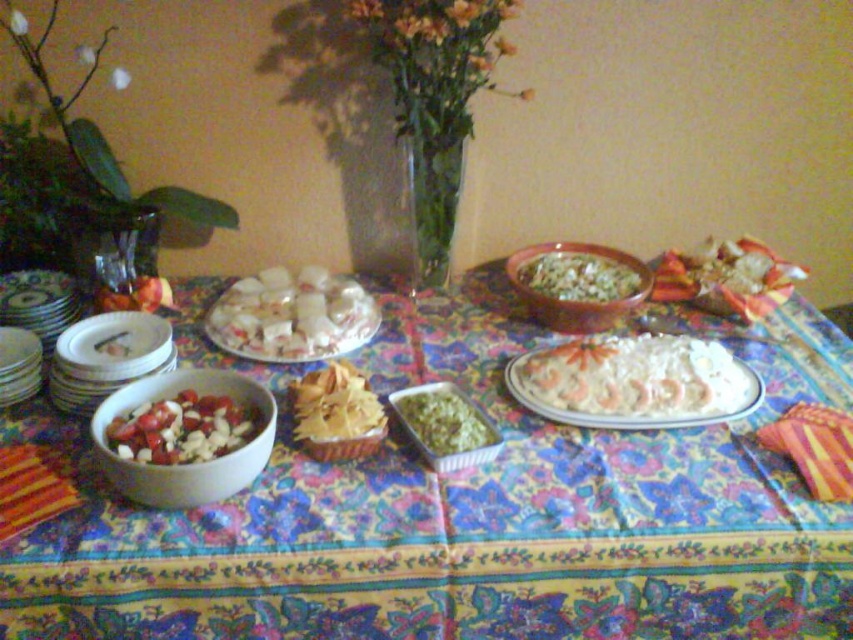
What do you see at coordinates (457, 513) in the screenshot? The height and width of the screenshot is (640, 853). I see `white ceramic bowl at center` at bounding box center [457, 513].

Does white ceramic bowl at center have a greater height compared to green leafy salad at center?

Yes.

Is point (483, 474) closer to viewer compared to point (573, 259)?

Yes, point (483, 474) is closer to viewer.

Identify the location of white ceramic bowl at center. point(457,513).

Does white creamy cubes at center have a lesser width compared to green textured rice at center?

In fact, white creamy cubes at center might be wider than green textured rice at center.

Can you confirm if white creamy cubes at center is positioned below green textured rice at center?

Actually, white creamy cubes at center is above green textured rice at center.

I want to click on white creamy cubes at center, so click(x=292, y=316).

Where is `white creamy cubes at center`? This screenshot has height=640, width=853. white creamy cubes at center is located at coordinates (292, 316).

From the picture: Between crinkled paper bag at right and striped fabric at lower right, which one is positioned higher?

crinkled paper bag at right

Does crinkled paper bag at right have a greater width compared to striped fabric at lower right?

Indeed, crinkled paper bag at right has a greater width compared to striped fabric at lower right.

The height and width of the screenshot is (640, 853). What are the coordinates of `crinkled paper bag at right` in the screenshot? It's located at (724, 275).